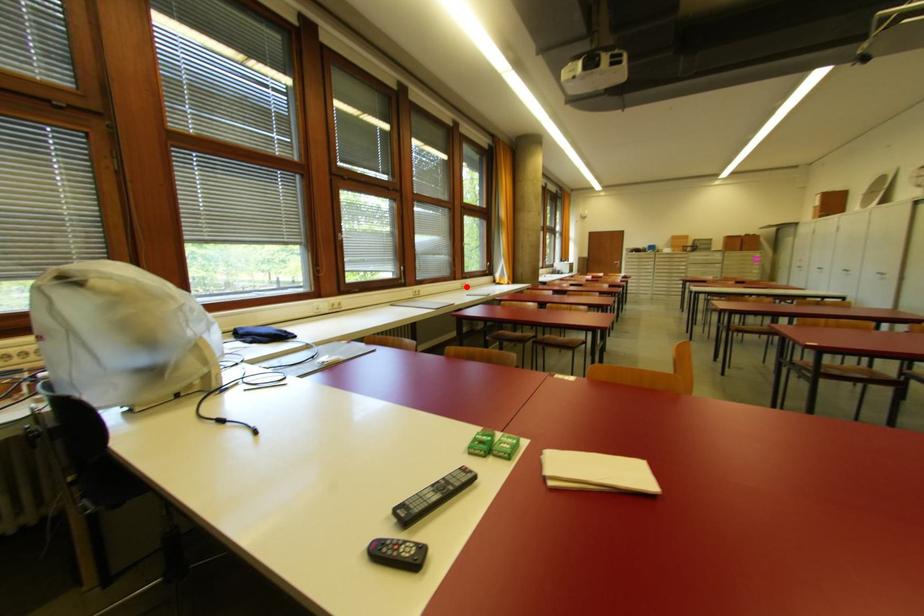
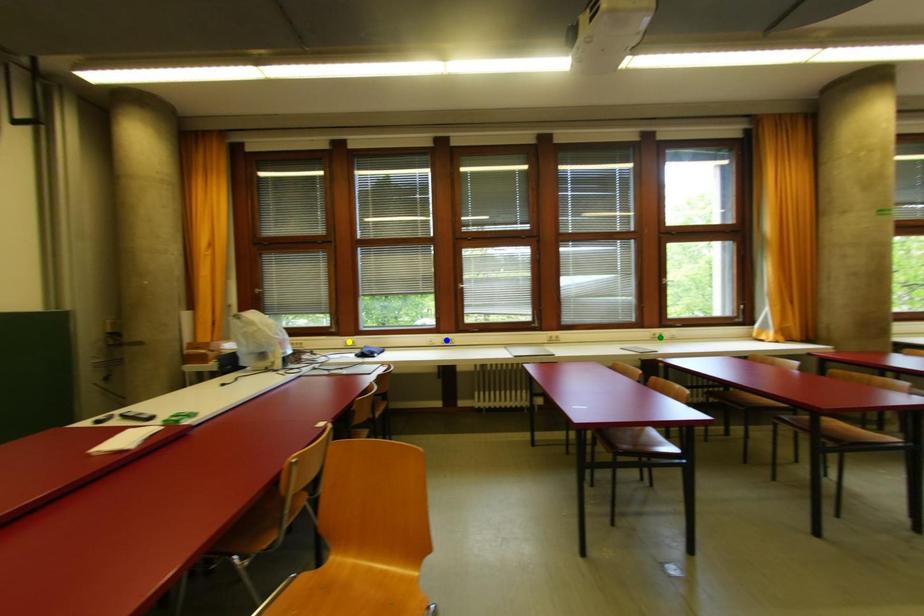
Question: I am providing you with two images of the same scene from different viewpoints. A red point is marked on the first image. You are given multiple points on the second image. Which point in image 2 is actually the same real-world point as the red point in image 1?

Choices:
 (A) blue point
 (B) green point
 (C) yellow point

Answer: (B)